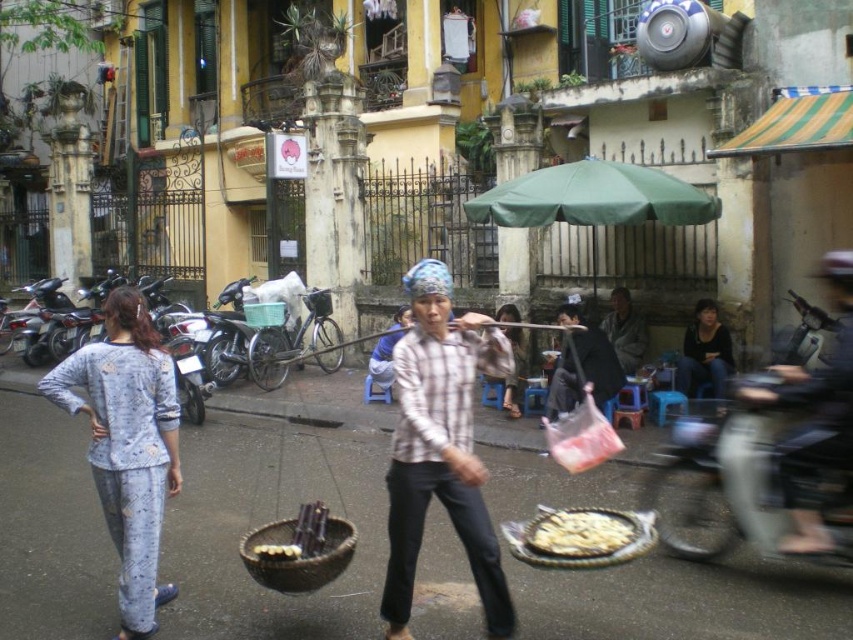
What is the object located at the coordinates point (440, 448) in the image?

The point (440, 448) corresponds to the plaid cotton shirt at center.

You are a photographer trying to capture the man in the plaid shirt at center and the dark brown leather jacket at lower right in the same frame. Which of the two items will appear smaller in your photo?

The dark brown leather jacket at lower right will appear smaller in the photo because it occupies less space than the plaid shirt at center.

You are a fashion designer observing the scene. You notice the plaid cotton shirt at center and the gray woolen sweater at center. Which clothing item is closer to the camera?

Both the plaid cotton shirt at center and gray woolen sweater at center are positioned at the same distance from the camera since they are both described as being at the center of the scene.